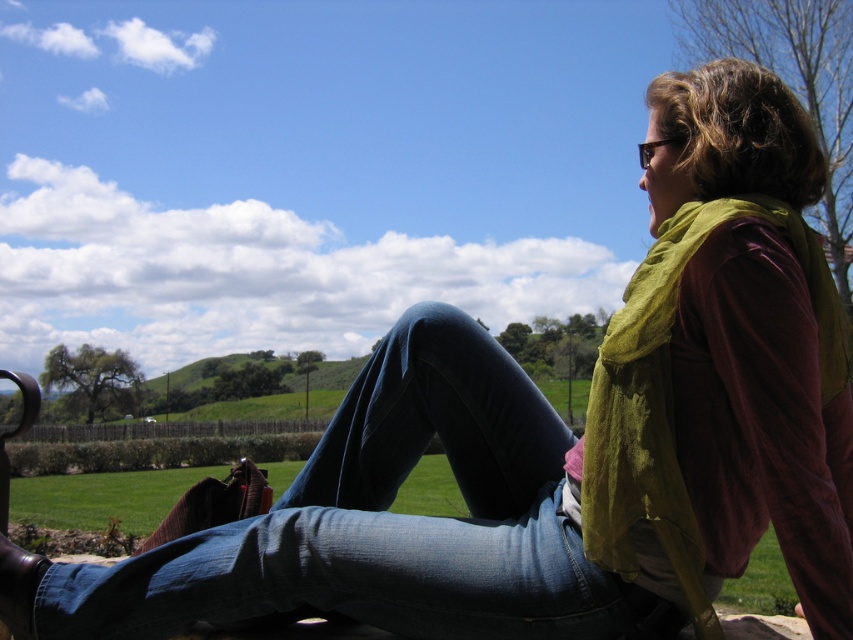
How much distance is there between denim at center and green sheer scarf at upper right?

They are 18.83 inches apart.

Consider the image. Can you confirm if denim at center is taller than green sheer scarf at upper right?

In fact, denim at center may be shorter than green sheer scarf at upper right.

Between point (503, 365) and point (689, 544), which one is positioned behind?

The point (503, 365) is behind.

Locate an element on the screen. denim at center is located at coordinates (387, 520).